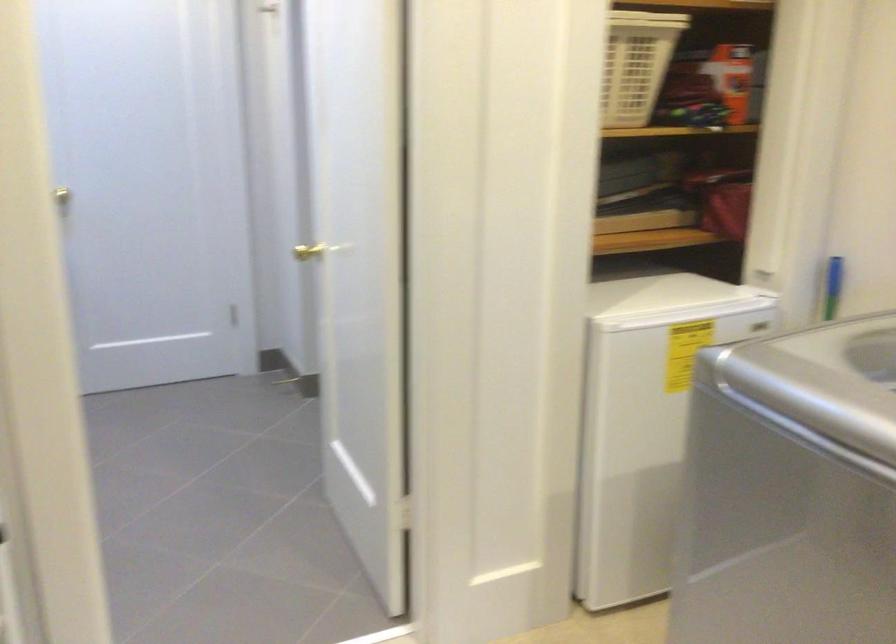
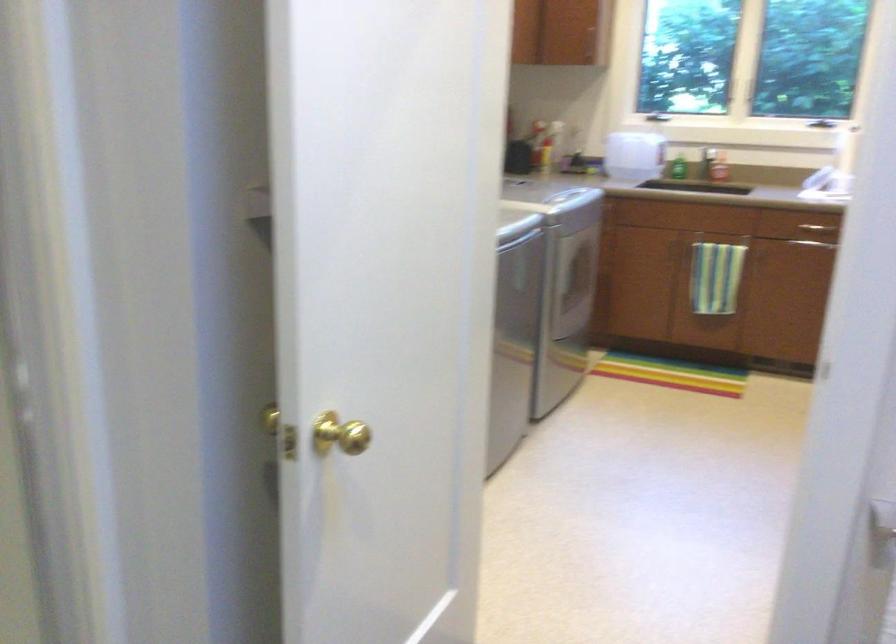
Locate, in the second image, the point that corresponds to (x=332, y=267) in the first image.

(339, 433)